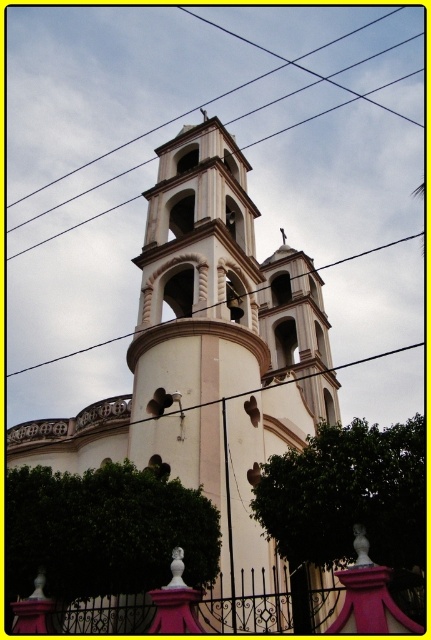
Question: Which point is closer to the camera taking this photo?

Choices:
 (A) (9, 257)
 (B) (103, 342)

Answer: (B)

Question: Is black wire at upper center to the right of black wire at center from the viewer's perspective?

Choices:
 (A) yes
 (B) no

Answer: (B)

Question: Is black wire at upper center below black wire at center?

Choices:
 (A) yes
 (B) no

Answer: (B)

Question: Is black wire at upper center above black wire at center?

Choices:
 (A) no
 (B) yes

Answer: (B)